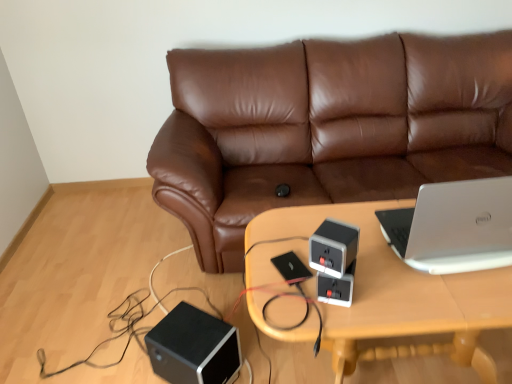
Question: Is gray matte speaker at center, which is the 2th speaker in left-to-right order, looking in the opposite direction of black matte speaker at lower left, the first speaker viewed from the back?

Choices:
 (A) yes
 (B) no

Answer: (B)

Question: From the image's perspective, is gray matte speaker at center, which is counted as the second speaker, starting from the back, on black matte speaker at lower left, acting as the 2th speaker starting from the right?

Choices:
 (A) no
 (B) yes

Answer: (B)

Question: Does gray matte speaker at center, which is the 2th speaker in left-to-right order, have a smaller size compared to black matte speaker at lower left, which ranks as the first speaker in bottom-to-top order?

Choices:
 (A) no
 (B) yes

Answer: (B)

Question: Does gray matte speaker at center, which is the 2th speaker in left-to-right order, have a lesser width compared to black matte speaker at lower left, acting as the 2th speaker starting from the right?

Choices:
 (A) no
 (B) yes

Answer: (B)

Question: Does gray matte speaker at center, which is the 2th speaker in left-to-right order, have a larger size compared to black matte speaker at lower left, placed as the second speaker when sorted from front to back?

Choices:
 (A) no
 (B) yes

Answer: (A)

Question: Does gray matte speaker at center, marked as the first speaker in a right-to-left arrangement, come in front of black matte speaker at lower left, the first speaker viewed from the back?

Choices:
 (A) no
 (B) yes

Answer: (B)

Question: From a real-world perspective, is gray matte speaker at center, marked as the first speaker in a right-to-left arrangement, below brown leather couch at center?

Choices:
 (A) no
 (B) yes

Answer: (A)

Question: Can you confirm if gray matte speaker at center, which is the 2th speaker in left-to-right order, is positioned to the left of brown leather couch at center?

Choices:
 (A) no
 (B) yes

Answer: (B)

Question: Is gray matte speaker at center, marked as the first speaker in a right-to-left arrangement, not close to brown leather couch at center?

Choices:
 (A) no
 (B) yes

Answer: (B)

Question: Is gray matte speaker at center, which is the 1th speaker from top to bottom, not inside brown leather couch at center?

Choices:
 (A) no
 (B) yes

Answer: (B)

Question: Does gray matte speaker at center, marked as the first speaker in a right-to-left arrangement, have a lesser width compared to brown leather couch at center?

Choices:
 (A) no
 (B) yes

Answer: (B)

Question: Is brown leather couch at center a part of gray matte speaker at center, which is the 1th speaker from top to bottom?

Choices:
 (A) no
 (B) yes

Answer: (A)

Question: Would you say gray matte speaker at center, which is counted as the second speaker, starting from the back, is part of black matte speaker at lower left, which ranks as the first speaker in bottom-to-top order,'s contents?

Choices:
 (A) yes
 (B) no

Answer: (B)